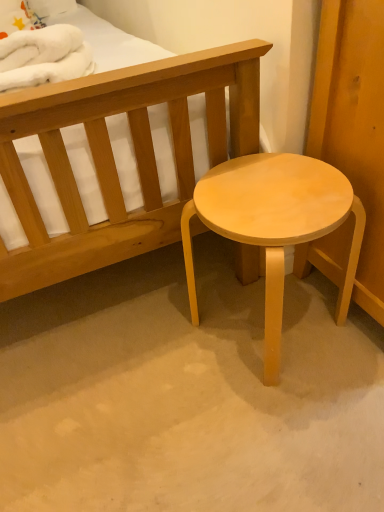
Locate an element on the screen. This screenshot has height=512, width=384. free point above light wood stool at center (from a real-world perspective) is located at coordinates pyautogui.click(x=269, y=191).